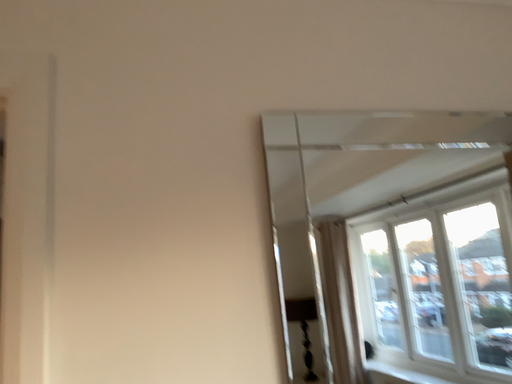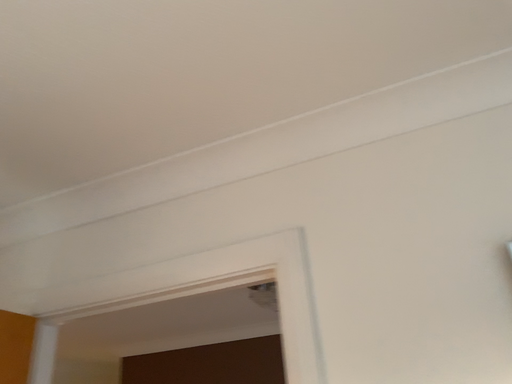
Question: Which way did the camera rotate in the video?

Choices:
 (A) rotated downward
 (B) rotated upward

Answer: (B)